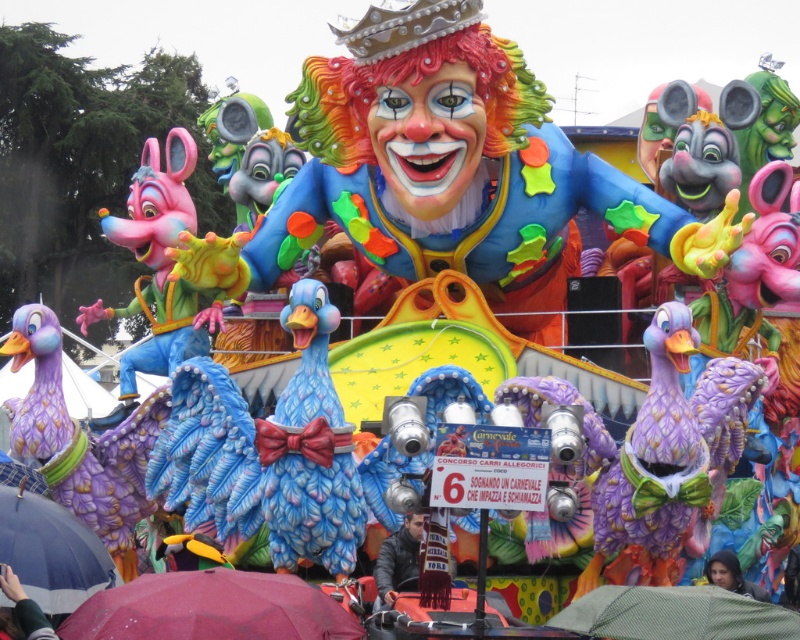
Based on the photo, what is located at the coordinates point (212, 609)?

The maroon fabric umbrella at lower center is located at point (212, 609).

You are a participant in the carnival parade and want to take a photo of both the maroon fabric umbrella at lower center and the dark gray fabric umbrella at lower left. However, you can only capture one in the foreground. Which umbrella should you position closer to the camera to ensure it appears larger in your photo?

To make the maroon fabric umbrella at lower center appear larger in the photo, position it closer to the camera since it is already above the dark gray fabric umbrella at lower left, meaning it is nearer to the viewer.